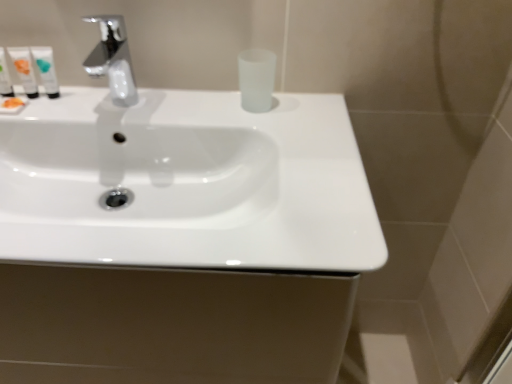
What do you see at coordinates (5, 77) in the screenshot?
I see `translucent plastic tube at left, positioned as the first mouthwash in left-to-right order` at bounding box center [5, 77].

I want to click on translucent plastic tube at left, positioned as the first mouthwash in left-to-right order, so click(5, 77).

Where is `white glossy tube at upper left, positioned as the third mouthwash in left-to-right order`? white glossy tube at upper left, positioned as the third mouthwash in left-to-right order is located at coordinates (46, 69).

What is the approximate height of chrome metallic faucet at upper left?

chrome metallic faucet at upper left is 5.82 inches tall.

What do you see at coordinates (113, 59) in the screenshot?
I see `chrome metallic faucet at upper left` at bounding box center [113, 59].

Image resolution: width=512 pixels, height=384 pixels. What are the coordinates of `frosted glass cup at center, the fourth mouthwash viewed from the left` in the screenshot? It's located at (256, 79).

Where is `translucent plastic tube at left, positioned as the first mouthwash in left-to-right order`? translucent plastic tube at left, positioned as the first mouthwash in left-to-right order is located at coordinates (5, 77).

Is white glossy tube at upper left, the 2th mouthwash viewed from the left, not inside chrome metallic faucet at upper left?

white glossy tube at upper left, the 2th mouthwash viewed from the left, lies outside chrome metallic faucet at upper left's area.

Is white glossy tube at upper left, marked as the 3th mouthwash in a right-to-left arrangement, taller than chrome metallic faucet at upper left?

In fact, white glossy tube at upper left, marked as the 3th mouthwash in a right-to-left arrangement, may be shorter than chrome metallic faucet at upper left.

Between white glossy tube at upper left, the 2th mouthwash viewed from the left, and chrome metallic faucet at upper left, which one has smaller size?

white glossy tube at upper left, the 2th mouthwash viewed from the left.

From a real-world perspective, is chrome metallic faucet at upper left on top of white glossy tube at upper left, positioned as the third mouthwash in left-to-right order?

Yes, from a real-world perspective, chrome metallic faucet at upper left is on top of white glossy tube at upper left, positioned as the third mouthwash in left-to-right order.

Where is `mouthwash that is the 4th object located above the chrome metallic faucet at upper left (from the image's perspective)`? This screenshot has width=512, height=384. mouthwash that is the 4th object located above the chrome metallic faucet at upper left (from the image's perspective) is located at coordinates (46, 69).

Which object is positioned more to the left, chrome metallic faucet at upper left or white glossy tube at upper left, the 2th mouthwash positioned from the right?

Positioned to the left is white glossy tube at upper left, the 2th mouthwash positioned from the right.

Considering the positions of point (122, 76) and point (47, 85), is point (122, 76) closer or farther from the camera than point (47, 85)?

Point (122, 76) appears to be farther away from the viewer than point (47, 85).

From the image's perspective, which is above, white glossy tube at upper left, the 2th mouthwash viewed from the left, or white glossy tube at upper left, the 2th mouthwash positioned from the right?

white glossy tube at upper left, the 2th mouthwash positioned from the right, from the image's perspective.

Is the depth of white glossy tube at upper left, marked as the 3th mouthwash in a right-to-left arrangement, less than that of white glossy tube at upper left, the 2th mouthwash positioned from the right?

Yes, it is.

Is white glossy tube at upper left, the 2th mouthwash viewed from the left, placed right next to white glossy tube at upper left, positioned as the third mouthwash in left-to-right order?

Absolutely, white glossy tube at upper left, the 2th mouthwash viewed from the left, is next to and touching white glossy tube at upper left, positioned as the third mouthwash in left-to-right order.

Is white glossy tube at upper left, the 2th mouthwash positioned from the right, surrounded by white glossy tube at upper left, marked as the 3th mouthwash in a right-to-left arrangement?

No, white glossy tube at upper left, the 2th mouthwash positioned from the right, is not surrounded by white glossy tube at upper left, marked as the 3th mouthwash in a right-to-left arrangement.

Considering the relative positions of chrome metallic faucet at upper left and white glossy tube at upper left, marked as the 3th mouthwash in a right-to-left arrangement, in the image provided, is chrome metallic faucet at upper left to the left of white glossy tube at upper left, marked as the 3th mouthwash in a right-to-left arrangement, from the viewer's perspective?

No, chrome metallic faucet at upper left is not to the left of white glossy tube at upper left, marked as the 3th mouthwash in a right-to-left arrangement.

Considering the sizes of objects chrome metallic faucet at upper left and white glossy tube at upper left, the 2th mouthwash viewed from the left, in the image provided, who is shorter, chrome metallic faucet at upper left or white glossy tube at upper left, the 2th mouthwash viewed from the left,?

white glossy tube at upper left, the 2th mouthwash viewed from the left, is shorter.

Which mouthwash is the 2nd one when counting from the left side of the chrome metallic faucet at upper left? Please provide its 2D coordinates.

[(24, 69)]

Is there a large distance between chrome metallic faucet at upper left and white glossy tube at upper left, the 2th mouthwash viewed from the left?

No, there isn't a large distance between chrome metallic faucet at upper left and white glossy tube at upper left, the 2th mouthwash viewed from the left.

Are white glossy tube at upper left, marked as the 3th mouthwash in a right-to-left arrangement, and white glossy sink at center making contact?

No, white glossy tube at upper left, marked as the 3th mouthwash in a right-to-left arrangement, is not touching white glossy sink at center.

Is point (29, 78) positioned before point (61, 122)?

No, it is not.

Between white glossy tube at upper left, the 2th mouthwash viewed from the left, and white glossy sink at center, which one has smaller width?

white glossy tube at upper left, the 2th mouthwash viewed from the left.

Is white glossy tube at upper left, marked as the 3th mouthwash in a right-to-left arrangement, surrounding white glossy sink at center?

That's incorrect, white glossy sink at center is not inside white glossy tube at upper left, marked as the 3th mouthwash in a right-to-left arrangement.

Is white glossy sink at center not within white glossy tube at upper left, marked as the 3th mouthwash in a right-to-left arrangement?

Absolutely, white glossy sink at center is external to white glossy tube at upper left, marked as the 3th mouthwash in a right-to-left arrangement.

Which of these two, white glossy sink at center or white glossy tube at upper left, the 2th mouthwash viewed from the left, is wider?

white glossy sink at center is wider.

Find the location of a particular element. sink in front of the white glossy tube at upper left, marked as the 3th mouthwash in a right-to-left arrangement is located at coordinates (187, 183).

Consider the image. From a real-world perspective, is white glossy tube at upper left, the 2th mouthwash positioned from the right, physically located above or below white glossy sink at center?

From a real-world perspective, white glossy tube at upper left, the 2th mouthwash positioned from the right, is physically above white glossy sink at center.

Does white glossy tube at upper left, the 2th mouthwash positioned from the right, appear on the right side of white glossy sink at center?

Incorrect, white glossy tube at upper left, the 2th mouthwash positioned from the right, is not on the right side of white glossy sink at center.

Between white glossy tube at upper left, positioned as the third mouthwash in left-to-right order, and white glossy sink at center, which one has larger size?

white glossy sink at center.

Looking at this image, looking at their sizes, would you say white glossy tube at upper left, the 2th mouthwash positioned from the right, is wider or thinner than white glossy sink at center?

Considering their sizes, white glossy tube at upper left, the 2th mouthwash positioned from the right, looks slimmer than white glossy sink at center.

In order to click on tap that appears below the white glossy tube at upper left, marked as the 3th mouthwash in a right-to-left arrangement (from the image's perspective) in this screenshot , I will do `click(113, 59)`.

Where is `the 4th mouthwash behind the chrome metallic faucet at upper left`? the 4th mouthwash behind the chrome metallic faucet at upper left is located at coordinates pos(46,69).

Considering their positions, is white glossy sink at center positioned closer to chrome metallic faucet at upper left than translucent plastic tube at left, positioned as the first mouthwash in left-to-right order?

translucent plastic tube at left, positioned as the first mouthwash in left-to-right order, is positioned closer to the anchor chrome metallic faucet at upper left.

Considering their positions, is white glossy tube at upper left, the 2th mouthwash positioned from the right, positioned closer to white glossy tube at upper left, marked as the 3th mouthwash in a right-to-left arrangement, than chrome metallic faucet at upper left?

white glossy tube at upper left, the 2th mouthwash positioned from the right, is positioned closer to the anchor white glossy tube at upper left, marked as the 3th mouthwash in a right-to-left arrangement.

Which object lies nearer to the anchor point chrome metallic faucet at upper left, white glossy tube at upper left, marked as the 3th mouthwash in a right-to-left arrangement, or translucent plastic tube at left, marked as the fourth mouthwash in a right-to-left arrangement?

Based on the image, white glossy tube at upper left, marked as the 3th mouthwash in a right-to-left arrangement, appears to be nearer to chrome metallic faucet at upper left.

Which object lies nearer to the anchor point white glossy sink at center, frosted glass cup at center, marked as the first mouthwash in a right-to-left arrangement, or chrome metallic faucet at upper left?

Based on the image, frosted glass cup at center, marked as the first mouthwash in a right-to-left arrangement, appears to be nearer to white glossy sink at center.

Estimate the real-world distances between objects in this image. Which object is further from white glossy sink at center, white glossy tube at upper left, marked as the 3th mouthwash in a right-to-left arrangement, or translucent plastic tube at left, marked as the fourth mouthwash in a right-to-left arrangement?

Among the two, translucent plastic tube at left, marked as the fourth mouthwash in a right-to-left arrangement, is located further to white glossy sink at center.

Estimate the real-world distances between objects in this image. Which object is further from frosted glass cup at center, the fourth mouthwash viewed from the left, white glossy tube at upper left, marked as the 3th mouthwash in a right-to-left arrangement, or chrome metallic faucet at upper left?

Among the two, white glossy tube at upper left, marked as the 3th mouthwash in a right-to-left arrangement, is located further to frosted glass cup at center, the fourth mouthwash viewed from the left.

Looking at the image, which one is located closer to chrome metallic faucet at upper left, translucent plastic tube at left, positioned as the first mouthwash in left-to-right order, or frosted glass cup at center, the fourth mouthwash viewed from the left?

Among the two, translucent plastic tube at left, positioned as the first mouthwash in left-to-right order, is located nearer to chrome metallic faucet at upper left.

In the scene shown: Based on their spatial positions, is frosted glass cup at center, marked as the first mouthwash in a right-to-left arrangement, or white glossy tube at upper left, positioned as the third mouthwash in left-to-right order, further from white glossy sink at center?

Among the two, white glossy tube at upper left, positioned as the third mouthwash in left-to-right order, is located further to white glossy sink at center.

Image resolution: width=512 pixels, height=384 pixels. What are the coordinates of `sink between white glossy tube at upper left, the 2th mouthwash positioned from the right, and frosted glass cup at center, the fourth mouthwash viewed from the left, from left to right` in the screenshot? It's located at (187, 183).

Where is `mouthwash between translucent plastic tube at left, positioned as the first mouthwash in left-to-right order, and white glossy tube at upper left, positioned as the third mouthwash in left-to-right order`? mouthwash between translucent plastic tube at left, positioned as the first mouthwash in left-to-right order, and white glossy tube at upper left, positioned as the third mouthwash in left-to-right order is located at coordinates (24, 69).

You are a GUI agent. You are given a task and a screenshot of the screen. Output one action in this format:
    pyautogui.click(x=<x>, y=<y>)
    Task: Click on the sink situated between white glossy tube at upper left, marked as the 3th mouthwash in a right-to-left arrangement, and frosted glass cup at center, the fourth mouthwash viewed from the left, from left to right
    This screenshot has height=384, width=512.
    Given the screenshot: What is the action you would take?
    pyautogui.click(x=187, y=183)

I want to click on tap situated between translucent plastic tube at left, marked as the fourth mouthwash in a right-to-left arrangement, and frosted glass cup at center, marked as the first mouthwash in a right-to-left arrangement, from left to right, so click(113, 59).